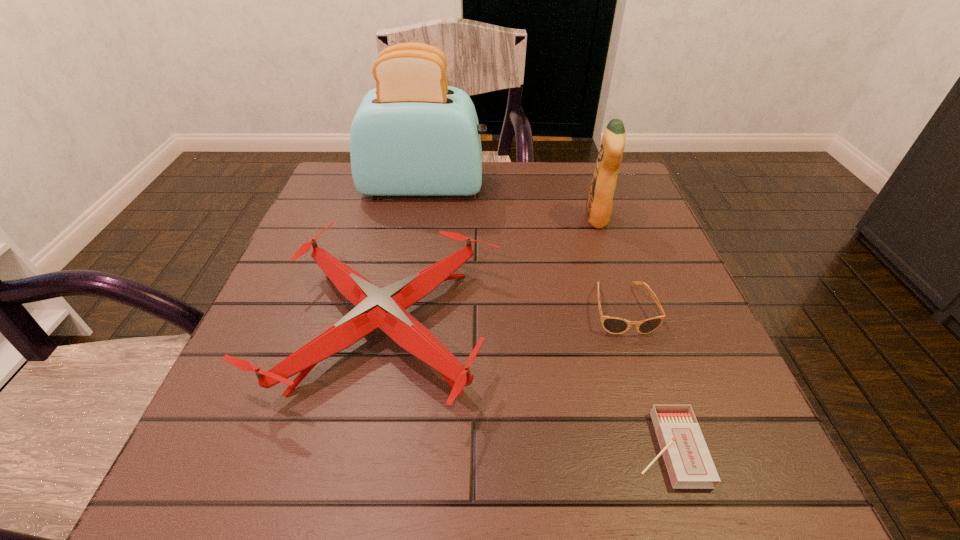
The image size is (960, 540). Identify the location of toaster. (413, 135).

This screenshot has width=960, height=540. I want to click on the farthest object, so click(x=413, y=135).

Where is `the fourth shortest object`? The image size is (960, 540). the fourth shortest object is located at coordinates (599, 202).

Image resolution: width=960 pixels, height=540 pixels. I want to click on detergent, so click(599, 202).

Identify the location of drone. (385, 308).

Where is `sunglasses`? sunglasses is located at coordinates (614, 325).

I want to click on matchbox, so click(688, 461).

This screenshot has width=960, height=540. I want to click on free space located 0.320m on the side of the farthest object with the lever, so (611, 186).

Image resolution: width=960 pixels, height=540 pixels. In order to click on vacant space positioned 0.230m on the label of the second tallest object in this screenshot , I will do `click(488, 218)`.

Where is `free spot located 0.370m on the label of the second tallest object`? free spot located 0.370m on the label of the second tallest object is located at coordinates (427, 218).